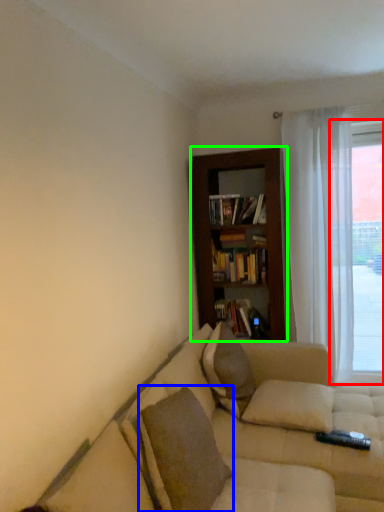
Question: Which object is the closest to the window (highlighted by a red box)? Choose among these: pillow (highlighted by a blue box) or bookcase (highlighted by a green box).

Choices:
 (A) pillow
 (B) bookcase

Answer: (B)